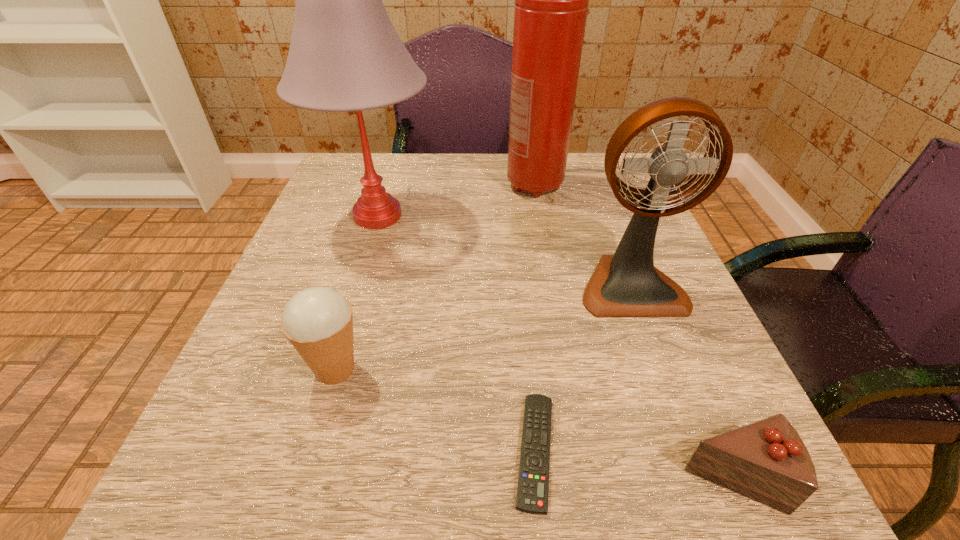
Locate an element on the screen. fire extinguisher is located at coordinates (551, 0).

Locate an element on the screen. table lamp is located at coordinates (345, 55).

Where is `the fourth shortest object`? the fourth shortest object is located at coordinates (627, 284).

Find the location of a particular element. The height and width of the screenshot is (540, 960). fan is located at coordinates (627, 284).

Image resolution: width=960 pixels, height=540 pixels. In order to click on icecream in this screenshot , I will do `click(318, 321)`.

Find the location of `the third shortest object`. the third shortest object is located at coordinates (318, 321).

What are the coordinates of `the second shortest object` in the screenshot? It's located at (767, 461).

You are a GUI agent. You are given a task and a screenshot of the screen. Output one action in this format:
    pyautogui.click(x=<x>, y=<y>)
    Task: Click on the shortest object
    
    Given the screenshot: What is the action you would take?
    [533, 480]

The height and width of the screenshot is (540, 960). Find the location of `free space located 0.120m on the handle side the fire extinguisher`. free space located 0.120m on the handle side the fire extinguisher is located at coordinates (544, 240).

Identify the location of free spot located on the front-facing side of the table lamp. (357, 284).